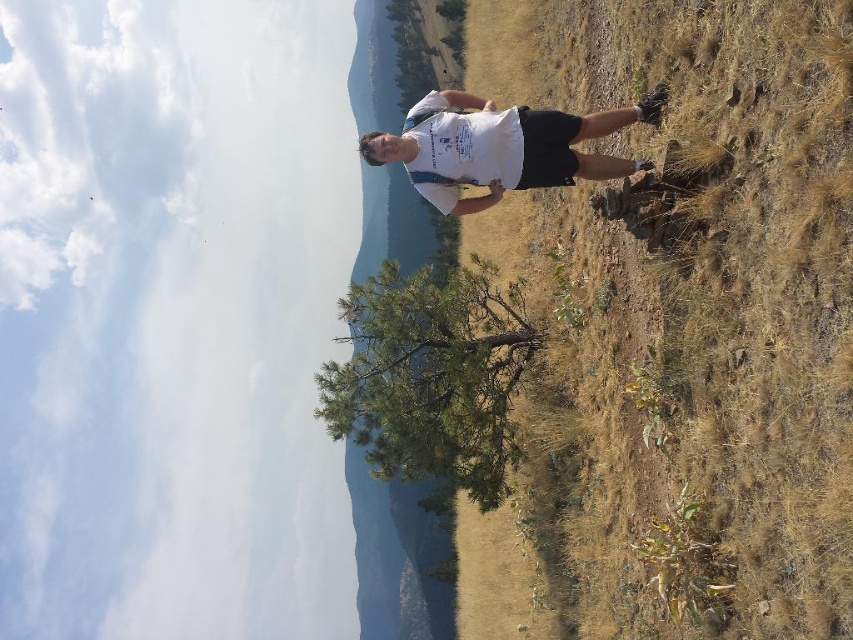
You are a photographer planning to take a portrait of the person wearing the white cotton shirt at center. The scene has brown grass at right that might be distracting. Can you confirm if the grass is taller than the shirt to determine if it will frame the subject appropriately?

The brown grass at right is much taller than the white cotton shirt at center, so it may frame the subject but could also be distracting due to its height.